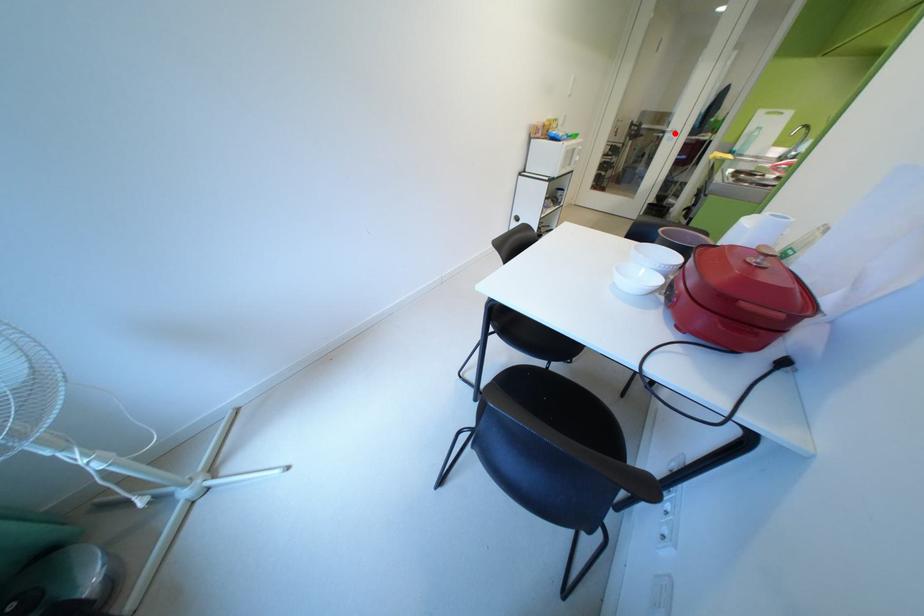
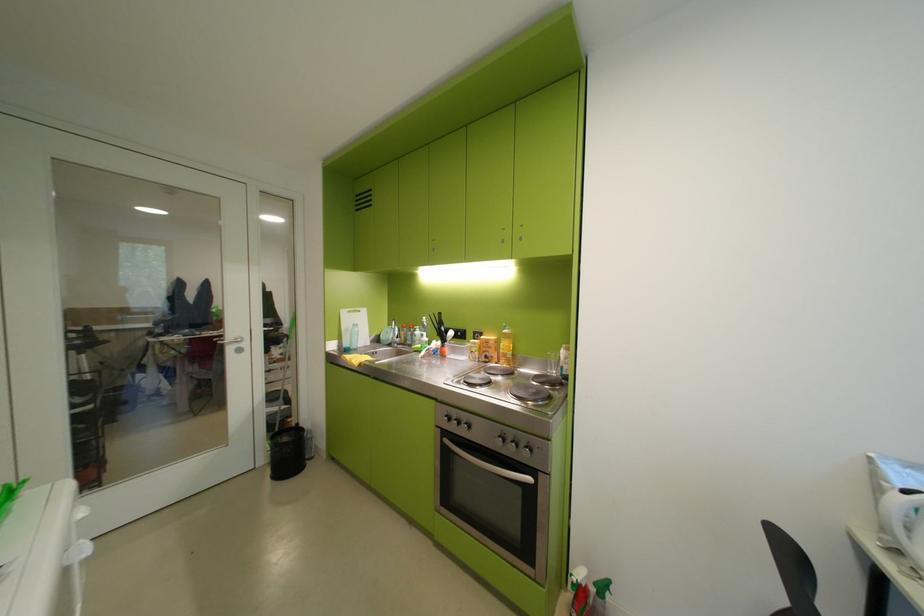
Locate, in the second image, the point that corresponds to the highlighted location in the first image.

(233, 346)